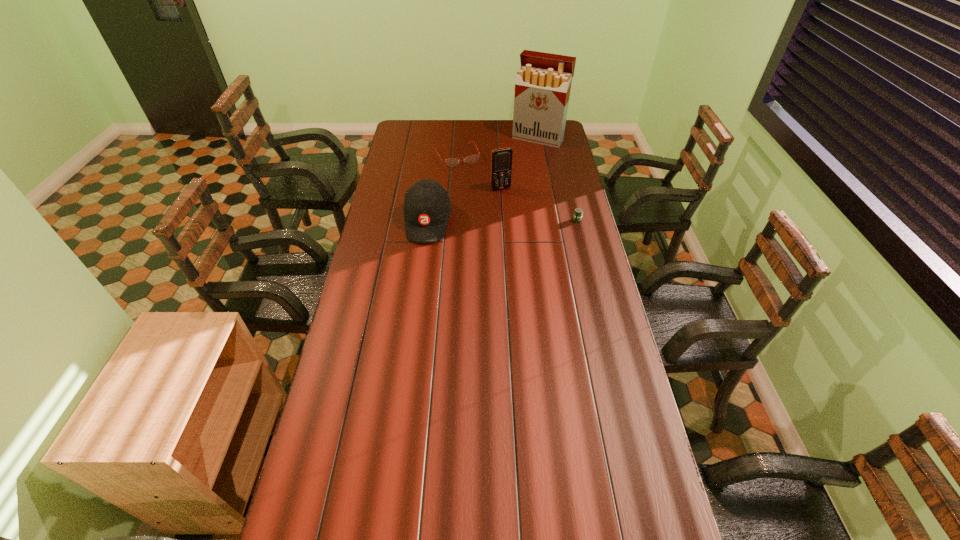
Where is `free space between the spectacles and the cellular telephone`? free space between the spectacles and the cellular telephone is located at coordinates (479, 172).

You are a GUI agent. You are given a task and a screenshot of the screen. Output one action in this format:
    pyautogui.click(x=<x>, y=<y>)
    Task: Click on the vacant area that lies between the third farthest object and the spectacles
    This screenshot has height=540, width=960.
    Given the screenshot: What is the action you would take?
    (479, 172)

You are a GUI agent. You are given a task and a screenshot of the screen. Output one action in this format:
    pyautogui.click(x=<x>, y=<y>)
    Task: Click on the vacant point located between the third object from left to right and the tallest object
    This screenshot has width=960, height=540.
    Given the screenshot: What is the action you would take?
    pyautogui.click(x=519, y=164)

Choose which object is the third nearest neighbor to the tallest object. Please provide its 2D coordinates. Your answer should be formatted as a tuple, i.e. [(x, y)], where the tuple contains the x and y coordinates of a point satisfying the conditions above.

[(578, 212)]

Locate an element on the screen. the fourth closest object to the beer can is located at coordinates (543, 83).

Image resolution: width=960 pixels, height=540 pixels. Find the location of `vacant point that satisfies the following two spatial constraints: 1. on the front side of the second tallest object; 2. on the left side of the beer can`. vacant point that satisfies the following two spatial constraints: 1. on the front side of the second tallest object; 2. on the left side of the beer can is located at coordinates (502, 220).